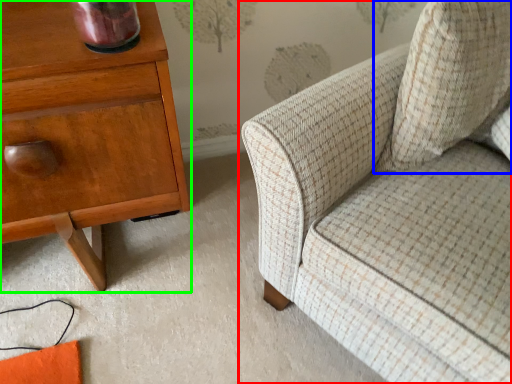
Question: Which object is the farthest from chair (highlighted by a red box)? Choose among these: throw pillow (highlighted by a blue box) or nightstand (highlighted by a green box).

Choices:
 (A) throw pillow
 (B) nightstand

Answer: (B)